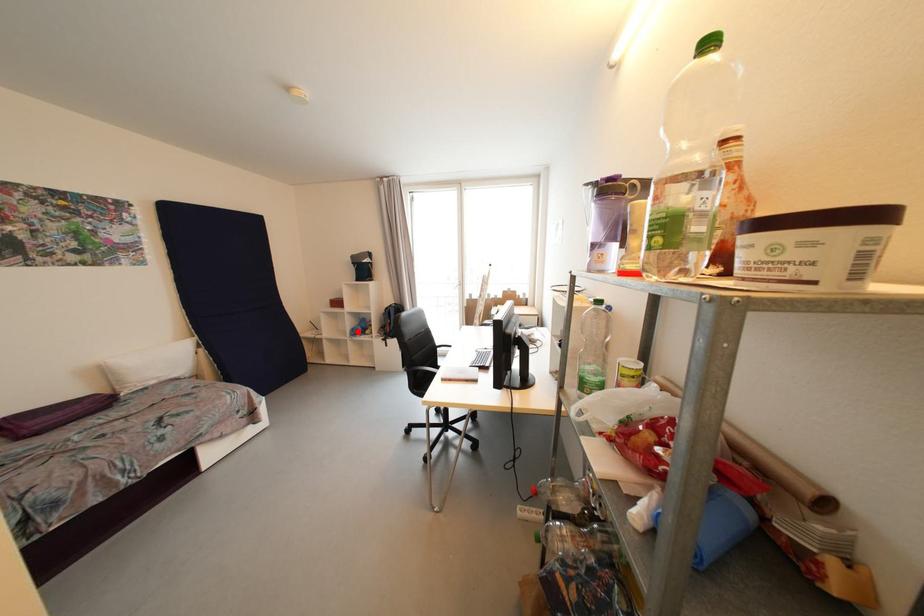
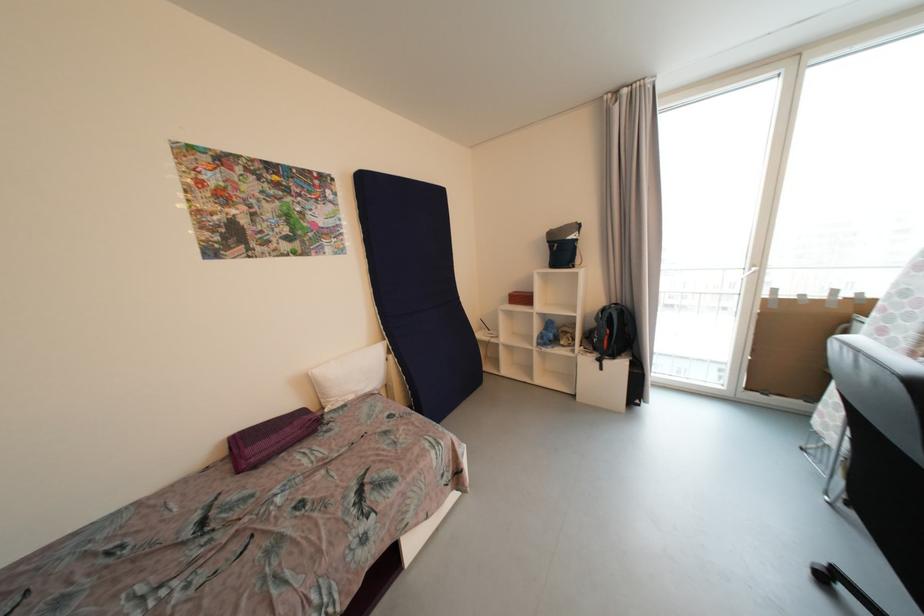
In the second image, find the point that corresponds to the highlighted location in the first image.

(545, 339)